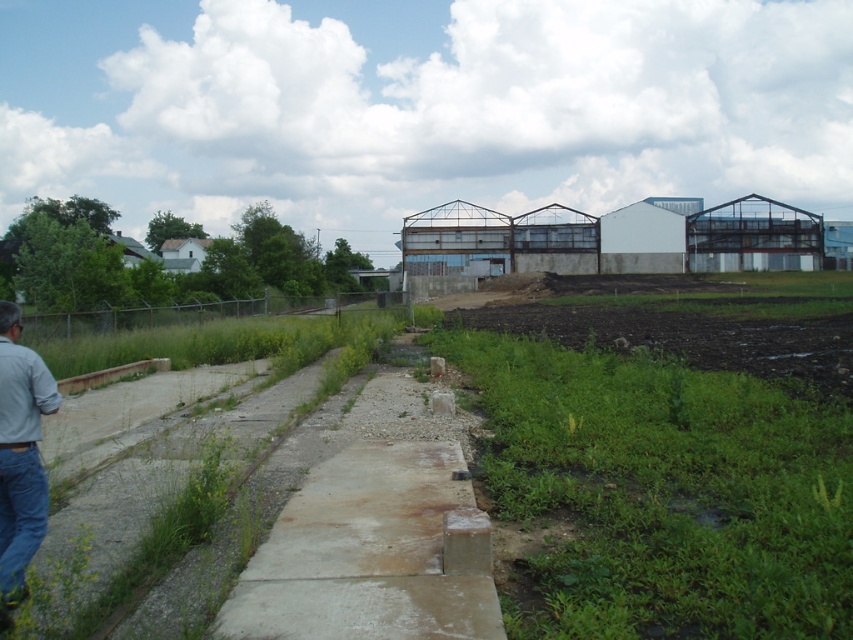
Question: Which point appears farthest from the camera in this image?

Choices:
 (A) (294, 580)
 (B) (20, 436)
 (C) (4, 458)
 (D) (560, 604)

Answer: (A)

Question: Which point is closer to the camera taking this photo?

Choices:
 (A) (28, 490)
 (B) (32, 451)
 (C) (248, 611)

Answer: (A)

Question: Which point is closer to the camera taking this photo?

Choices:
 (A) (38, 538)
 (B) (56, 406)
 (C) (547, 394)

Answer: (A)

Question: Considering the relative positions of concrete at center and denim at left in the image provided, where is concrete at center located with respect to denim at left?

Choices:
 (A) right
 (B) left

Answer: (A)

Question: Does green grassy field at center-right have a lesser width compared to concrete at center?

Choices:
 (A) no
 (B) yes

Answer: (A)

Question: Does blue denim jeans at lower left appear on the left side of denim at left?

Choices:
 (A) no
 (B) yes

Answer: (B)